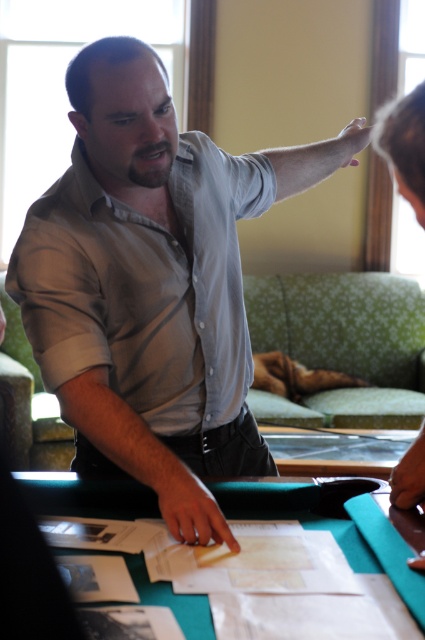
You are standing at the camera position and see the point marked as point (x=130, y=413). If you want to reach it without moving your feet, can you touch it with your outstretched hand?

The point marked as point (x=130, y=413) is 4.25 feet from the camera. Since the average person can reach about 2.5 feet in front of them, you cannot touch it without moving your feet.

You are an observer in the room. You see the gray matte shirt at center and the gray fabric arm at upper center. Which object is located to the left of the other?

The gray matte shirt at center is positioned on the left side of gray fabric arm at upper center.